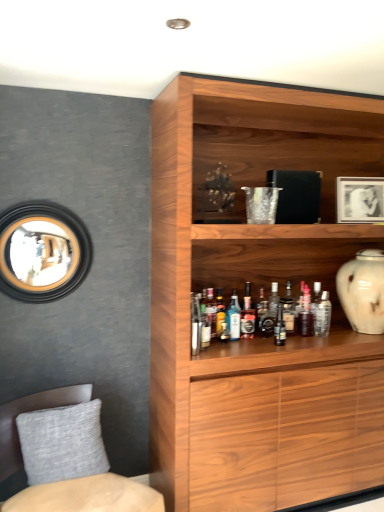
Identify the location of wooden cabinet at upper center. (243, 236).

What do you see at coordinates (262, 313) in the screenshot? The width and height of the screenshot is (384, 512). I see `shiny dark brown bottle at center, which is the 5th bottle from left to right` at bounding box center [262, 313].

Measure the distance between point [223,333] and camera.

Point [223,333] and camera are 7.88 feet apart.

Describe the element at coordinates (220, 314) in the screenshot. Image resolution: width=384 pixels, height=512 pixels. I see `translucent glass bottle at shelf center, the 2th bottle viewed from the left` at that location.

The image size is (384, 512). What do you see at coordinates (42, 251) in the screenshot?
I see `gold-framed mirror at upper left` at bounding box center [42, 251].

Describe the element at coordinates (91, 496) in the screenshot. The width and height of the screenshot is (384, 512). I see `textured gray cushion at lower left` at that location.

Identify the location of translucent glass bottle at shelf center, placed as the fourth bottle when sorted from left to right. The width and height of the screenshot is (384, 512). (247, 316).

The width and height of the screenshot is (384, 512). In order to click on white glossy vase at right in this screenshot , I will do `click(363, 291)`.

Identify the location of wooden cabinet at upper center. (243, 236).

From the image's perspective, is translucent glass bottle at shelf center, positioned as the sixth bottle in right-to-left order, above or below translucent glass bottle at shelf center, positioned as the eighth bottle in right-to-left order?

Based on their image positions, translucent glass bottle at shelf center, positioned as the sixth bottle in right-to-left order, is located above translucent glass bottle at shelf center, positioned as the eighth bottle in right-to-left order.

Is translucent glass bottle at shelf center, placed as the fourth bottle when sorted from left to right, smaller than translucent glass bottle at shelf center, the 2th bottle viewed from the left?

No.

Consider the image. Is translucent glass bottle at shelf center, placed as the fourth bottle when sorted from left to right, positioned with its back to translucent glass bottle at shelf center, the 2th bottle viewed from the left?

translucent glass bottle at shelf center, placed as the fourth bottle when sorted from left to right, is not turned away from translucent glass bottle at shelf center, the 2th bottle viewed from the left.

Is translucent glass bottle at shelf center, the 2th bottle viewed from the left, a part of translucent glass bottle at shelf center, positioned as the sixth bottle in right-to-left order?

No, translucent glass bottle at shelf center, the 2th bottle viewed from the left, is not inside translucent glass bottle at shelf center, positioned as the sixth bottle in right-to-left order.

From the image's perspective, which one is positioned lower, shiny dark brown bottle at center, acting as the 5th bottle starting from the right, or gold-framed mirror at upper left?

shiny dark brown bottle at center, acting as the 5th bottle starting from the right, is shown below in the image.

Between shiny dark brown bottle at center, acting as the 5th bottle starting from the right, and gold-framed mirror at upper left, which one has smaller size?

With smaller size is shiny dark brown bottle at center, acting as the 5th bottle starting from the right.

Is shiny dark brown bottle at center, which is the 5th bottle from left to right, directly adjacent to gold-framed mirror at upper left?

No, shiny dark brown bottle at center, which is the 5th bottle from left to right, is not in contact with gold-framed mirror at upper left.

Considering the sizes of objects shiny dark brown bottle at center, acting as the 5th bottle starting from the right, and translucent glass bottle at shelf center, the 2th bottle viewed from the left, in the image provided, who is shorter, shiny dark brown bottle at center, acting as the 5th bottle starting from the right, or translucent glass bottle at shelf center, the 2th bottle viewed from the left,?

translucent glass bottle at shelf center, the 2th bottle viewed from the left, is shorter.

Does point (258, 318) come behind point (219, 298)?

No, it is not.

Could translucent glass bottle at shelf center, positioned as the eighth bottle in right-to-left order, be considered to be inside shiny dark brown bottle at center, acting as the 5th bottle starting from the right?

Actually, translucent glass bottle at shelf center, positioned as the eighth bottle in right-to-left order, is outside shiny dark brown bottle at center, acting as the 5th bottle starting from the right.

Can you tell me how much shiny dark brown bottle at center, acting as the 5th bottle starting from the right, and translucent glass bottle at shelf center, positioned as the eighth bottle in right-to-left order, differ in facing direction?

1.27 degrees separate the facing orientations of shiny dark brown bottle at center, acting as the 5th bottle starting from the right, and translucent glass bottle at shelf center, positioned as the eighth bottle in right-to-left order.

Looking at this image, which object is positioned more to the left, translucent glass bottle at center, positioned as the 2th bottle in right-to-left order, or textured gray cushion at lower left?

textured gray cushion at lower left is more to the left.

From a real-world perspective, who is located lower, translucent glass bottle at center, positioned as the 2th bottle in right-to-left order, or textured gray cushion at lower left?

textured gray cushion at lower left.

Between translucent glass bottle at center, marked as the 8th bottle in a left-to-right arrangement, and textured gray cushion at lower left, which one has more height?

textured gray cushion at lower left is taller.

Does gold-framed mirror at upper left appear on the right side of translucent glass bottle at center, marked as the 8th bottle in a left-to-right arrangement?

No, gold-framed mirror at upper left is not to the right of translucent glass bottle at center, marked as the 8th bottle in a left-to-right arrangement.

Considering the sizes of objects gold-framed mirror at upper left and translucent glass bottle at center, positioned as the 2th bottle in right-to-left order, in the image provided, who is shorter, gold-framed mirror at upper left or translucent glass bottle at center, positioned as the 2th bottle in right-to-left order,?

With less height is translucent glass bottle at center, positioned as the 2th bottle in right-to-left order.

Is gold-framed mirror at upper left not close to translucent glass bottle at center, marked as the 8th bottle in a left-to-right arrangement?

gold-framed mirror at upper left is far away from translucent glass bottle at center, marked as the 8th bottle in a left-to-right arrangement.

From the image's perspective, is gold-framed mirror at upper left positioned above or below translucent glass bottle at center, positioned as the 2th bottle in right-to-left order?

Based on their image positions, gold-framed mirror at upper left is located above translucent glass bottle at center, positioned as the 2th bottle in right-to-left order.

In the scene shown: Considering the sizes of objects white glossy picture frame at upper right and white glossy vase at right in the image provided, who is thinner, white glossy picture frame at upper right or white glossy vase at right?

Thinner between the two is white glossy picture frame at upper right.

How many degrees apart are the facing directions of white glossy picture frame at upper right and white glossy vase at right?

They differ by 14.3 degrees in their facing directions.

Considering the positions of objects white glossy picture frame at upper right and white glossy vase at right in the image provided, who is in front, white glossy picture frame at upper right or white glossy vase at right?

white glossy vase at right is closer to the camera.

Does white glossy picture frame at upper right have a smaller size compared to white glossy vase at right?

Indeed, white glossy picture frame at upper right has a smaller size compared to white glossy vase at right.

Does translucent glass bottle at center, positioned as the 2th bottle in right-to-left order, have a smaller size compared to shiny dark brown bottle at center, which is the 5th bottle from left to right?

Incorrect, translucent glass bottle at center, positioned as the 2th bottle in right-to-left order, is not smaller in size than shiny dark brown bottle at center, which is the 5th bottle from left to right.

Which object is positioned more to the left, translucent glass bottle at center, positioned as the 2th bottle in right-to-left order, or shiny dark brown bottle at center, acting as the 5th bottle starting from the right?

shiny dark brown bottle at center, acting as the 5th bottle starting from the right, is more to the left.

Which of these two, translucent glass bottle at center, marked as the 8th bottle in a left-to-right arrangement, or shiny dark brown bottle at center, which is the 5th bottle from left to right, is thinner?

With smaller width is translucent glass bottle at center, marked as the 8th bottle in a left-to-right arrangement.

From a real-world perspective, is translucent glass bottle at center, marked as the 8th bottle in a left-to-right arrangement, above or below shiny dark brown bottle at center, acting as the 5th bottle starting from the right?

From a real-world perspective, translucent glass bottle at center, marked as the 8th bottle in a left-to-right arrangement, is physically above shiny dark brown bottle at center, acting as the 5th bottle starting from the right.

At what (x,y) coordinates should I click in order to perform the action: click on bottle that is the 2nd one when counting rightward from the translucent glass bottle at shelf center, positioned as the eighth bottle in right-to-left order. Please return your answer as a coordinate pair (x, y). Looking at the image, I should click on (247, 316).

Which bottle is the 5th one when counting from the back of the gold-framed mirror at upper left? Please provide its 2D coordinates.

[(262, 313)]

Based on their spatial positions, is translucent glass bottle at center, the ninth bottle when ordered from right to left, or translucent glass bottle at shelf center, arranged as the 4th bottle when viewed from the right, closer to matte glass bottle at center, which is the 3th bottle from right to left?

translucent glass bottle at shelf center, arranged as the 4th bottle when viewed from the right.

Looking at the image, which one is located further to translucent glass bottle at shelf center, placed as the fourth bottle when sorted from left to right, textured gray cushion at lower left or shiny dark brown bottle at center, which is the 5th bottle from left to right?

textured gray cushion at lower left lies further to translucent glass bottle at shelf center, placed as the fourth bottle when sorted from left to right, than the other object.

When comparing their distances from translucent glass bottle at shelf center, arranged as the 4th bottle when viewed from the right, does clear glass bottle at shelf center, which is counted as the 9th bottle, starting from the left, or gray fabric pillow at lower left seem closer?

Based on the image, clear glass bottle at shelf center, which is counted as the 9th bottle, starting from the left, appears to be nearer to translucent glass bottle at shelf center, arranged as the 4th bottle when viewed from the right.

Consider the image. Which object lies nearer to the anchor point blue glass bottle at center, which is the 7th bottle from right to left, gold-framed mirror at upper left or textured gray cushion at lower left?

The object closer to blue glass bottle at center, which is the 7th bottle from right to left, is textured gray cushion at lower left.

Looking at this image, looking at the image, which one is located further to white glossy vase at right, clear glass bottle at shelf center, which is counted as the 9th bottle, starting from the left, or gold-framed mirror at upper left?

gold-framed mirror at upper left.

From the image, which object appears to be farther from white glossy vase at right, matte glass bottle at center, the 7th bottle viewed from the left, or wooden cabinet at upper center?

The object further to white glossy vase at right is wooden cabinet at upper center.

Based on the photo, estimate the real-world distances between objects in this image. Which object is closer to clear glass bottle at shelf center, marked as the first bottle in a right-to-left arrangement, matte glass bottle at center, which is the 3th bottle from right to left, or translucent glass bottle at center, marked as the 8th bottle in a left-to-right arrangement?

translucent glass bottle at center, marked as the 8th bottle in a left-to-right arrangement.

When comparing their distances from gold-framed mirror at upper left, does translucent glass bottle at center, positioned as the 2th bottle in right-to-left order, or translucent glass bottle at center, placed as the 1th bottle when sorted from left to right, seem closer?

Among the two, translucent glass bottle at center, placed as the 1th bottle when sorted from left to right, is located nearer to gold-framed mirror at upper left.

At what (x,y) coordinates should I click in order to perform the action: click on picture frame between gray fabric pillow at lower left and white glossy vase at right from left to right. Please return your answer as a coordinate pair (x, y). Looking at the image, I should click on (359, 199).

Find the location of a particular element. pillow between gold-framed mirror at upper left and translucent glass bottle at center, marked as the 8th bottle in a left-to-right arrangement, in the horizontal direction is located at coordinates (62, 443).

The image size is (384, 512). I want to click on cupboard situated between translucent glass bottle at shelf center, positioned as the eighth bottle in right-to-left order, and white glossy picture frame at upper right from left to right, so click(243, 236).

Where is `pillow between textured gray cushion at lower left and blue glass bottle at center, acting as the third bottle starting from the left, along the z-axis`? This screenshot has height=512, width=384. pillow between textured gray cushion at lower left and blue glass bottle at center, acting as the third bottle starting from the left, along the z-axis is located at coordinates 62,443.